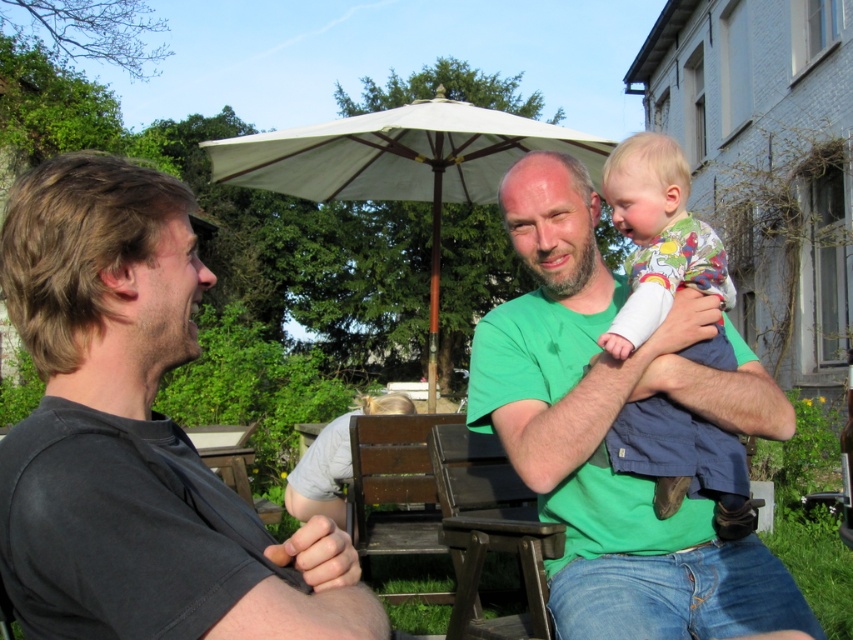
Question: Which point appears farthest from the camera in this image?

Choices:
 (A) (631, 525)
 (B) (364, 150)
 (C) (19, 477)
 (D) (657, 470)

Answer: (B)

Question: From the image, what is the correct spatial relationship of dark gray t-shirt at left in relation to floral fabric baby at center?

Choices:
 (A) below
 (B) above

Answer: (A)

Question: Does green cotton shirt at center have a lesser width compared to white fabric umbrella at center?

Choices:
 (A) no
 (B) yes

Answer: (B)

Question: Considering the relative positions of dark gray t-shirt at left and green cotton shirt at center in the image provided, where is dark gray t-shirt at left located with respect to green cotton shirt at center?

Choices:
 (A) right
 (B) left

Answer: (B)

Question: Which point is farther to the camera?

Choices:
 (A) floral fabric baby at center
 (B) dark gray t-shirt at left

Answer: (A)

Question: Which of these objects is positioned closest to the white fabric umbrella at center?

Choices:
 (A) green cotton shirt at center
 (B) floral fabric baby at center
 (C) dark gray t-shirt at left

Answer: (A)